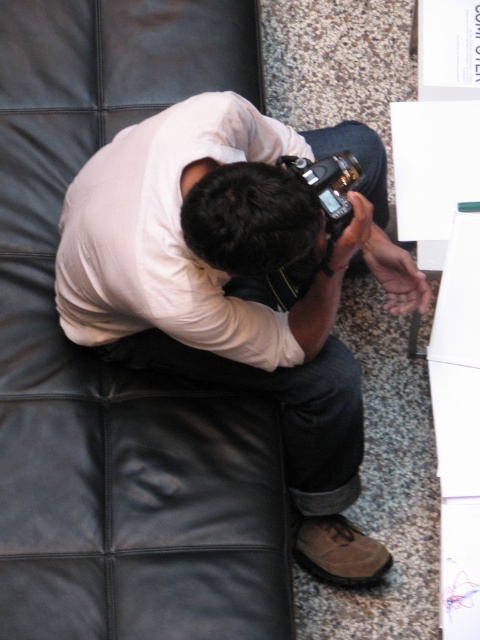
Question: Does black leather couch at upper left have a lesser width compared to white matte shirt at center?

Choices:
 (A) no
 (B) yes

Answer: (B)

Question: Which point appears farthest from the camera in this image?

Choices:
 (A) (94, 497)
 (B) (223, 120)

Answer: (A)

Question: Can you confirm if black leather couch at upper left is wider than white matte shirt at center?

Choices:
 (A) yes
 (B) no

Answer: (B)

Question: Which of the following is the closest to the observer?

Choices:
 (A) (85, 164)
 (B) (12, 172)

Answer: (A)

Question: Considering the relative positions of black leather couch at upper left and white matte shirt at center in the image provided, where is black leather couch at upper left located with respect to white matte shirt at center?

Choices:
 (A) right
 (B) left

Answer: (B)

Question: Which of the following is the closest to the observer?

Choices:
 (A) white matte shirt at center
 (B) black leather couch at upper left

Answer: (A)